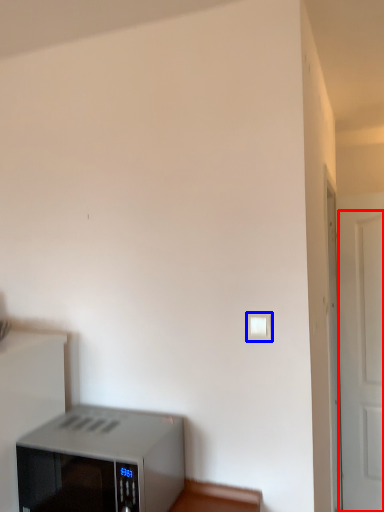
Question: Which point is further to the camera, door (highlighted by a red box) or light switch (highlighted by a blue box)?

Choices:
 (A) door
 (B) light switch

Answer: (A)